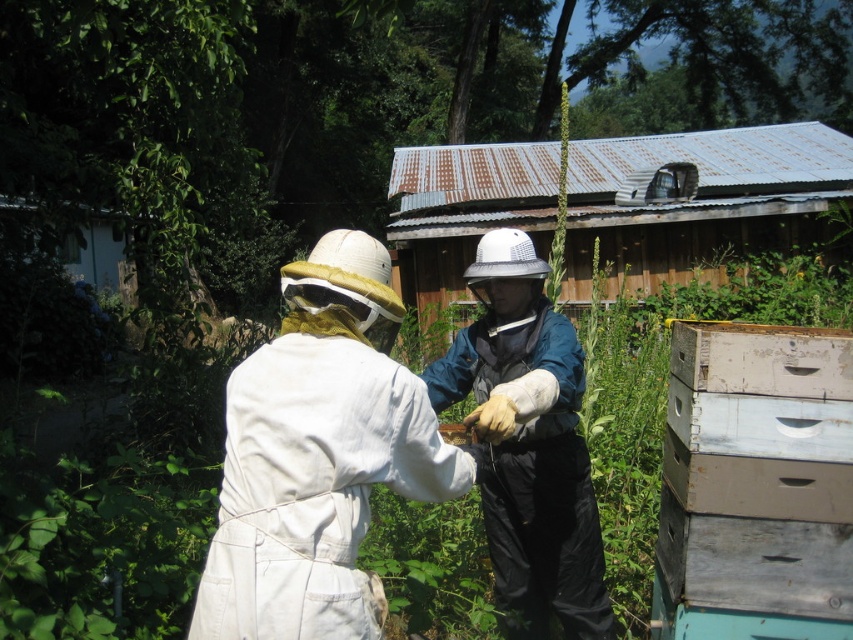
Who is positioned more to the left, white cotton beekeeper suit at center or weathered wood beehive at right?

From the viewer's perspective, white cotton beekeeper suit at center appears more on the left side.

What do you see at coordinates (318, 456) in the screenshot? This screenshot has height=640, width=853. I see `white cotton beekeeper suit at center` at bounding box center [318, 456].

Locate an element on the screen. Image resolution: width=853 pixels, height=640 pixels. white cotton beekeeper suit at center is located at coordinates (318, 456).

Between white cotton beekeeper suit at center and teal fabric vest at center, which one is positioned higher?

white cotton beekeeper suit at center is above.

How far apart are white cotton beekeeper suit at center and teal fabric vest at center?

white cotton beekeeper suit at center and teal fabric vest at center are 32.35 inches apart from each other.

Identify the location of white cotton beekeeper suit at center. (318, 456).

Which is more to the right, weathered wood beehive at right or teal fabric vest at center?

weathered wood beehive at right is more to the right.

Is the position of weathered wood beehive at right less distant than that of teal fabric vest at center?

No, weathered wood beehive at right is behind teal fabric vest at center.

Image resolution: width=853 pixels, height=640 pixels. What do you see at coordinates (756, 484) in the screenshot?
I see `weathered wood beehive at right` at bounding box center [756, 484].

At what (x,y) coordinates should I click in order to perform the action: click on weathered wood beehive at right. Please return your answer as a coordinate pair (x, y). This screenshot has width=853, height=640. Looking at the image, I should click on click(756, 484).